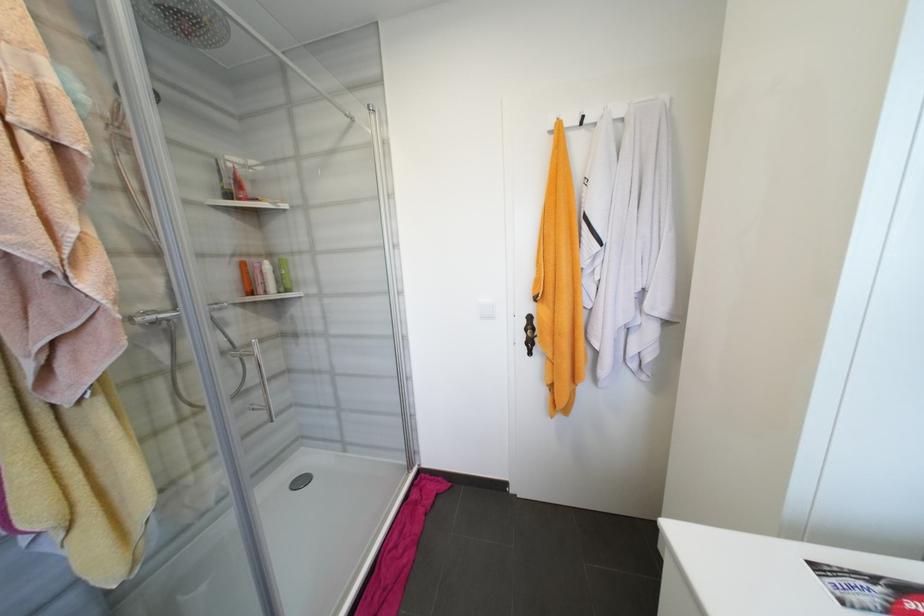
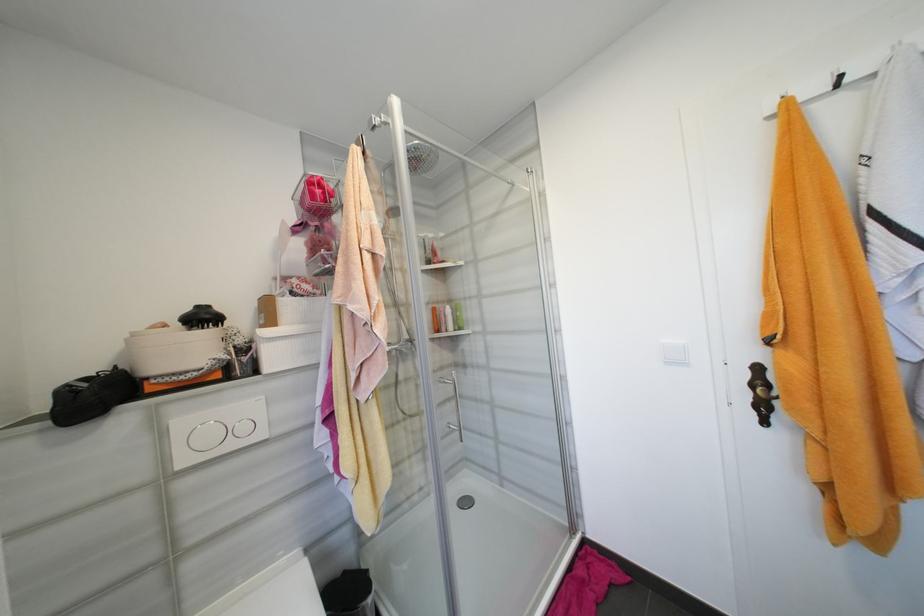
The point at (242, 261) is marked in the first image. Where is the corresponding point in the second image?

(436, 307)